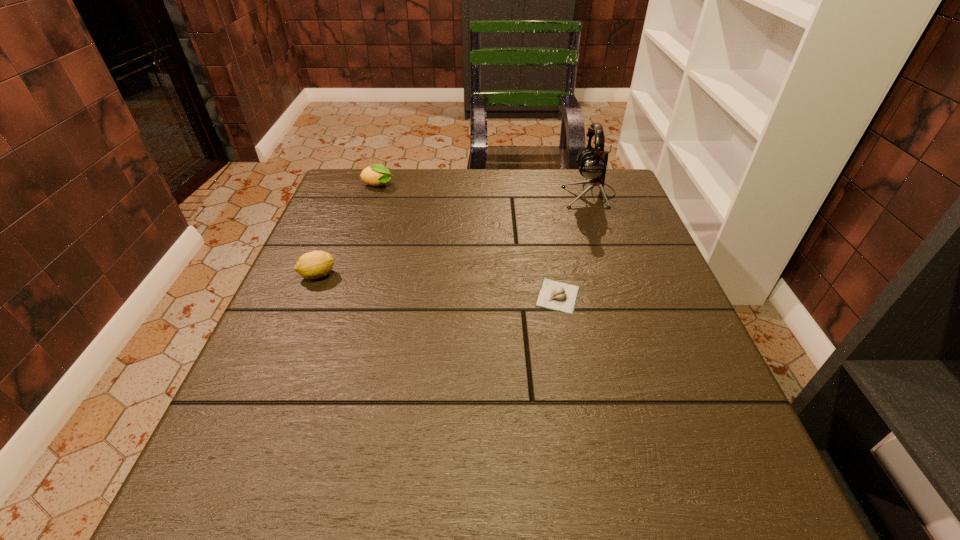
Locate an element on the screen. earphone situated at the far edge is located at coordinates (592, 163).

Find the location of a particular element. lemon situated at the far edge is located at coordinates (376, 175).

In order to click on object that is positioned at the right edge in this screenshot , I will do `click(592, 163)`.

Locate an element on the screen. The height and width of the screenshot is (540, 960). object located at the far left corner is located at coordinates (376, 175).

At what (x,y) coordinates should I click in order to perform the action: click on object situated at the far right corner. Please return your answer as a coordinate pair (x, y). Looking at the image, I should click on (592, 163).

Where is `vacant space at the far edge of the desktop`? vacant space at the far edge of the desktop is located at coordinates (474, 212).

The width and height of the screenshot is (960, 540). What are the coordinates of `free spot at the near edge of the desktop` in the screenshot? It's located at [312, 501].

This screenshot has width=960, height=540. In order to click on free region at the left edge in this screenshot , I will do coord(316,238).

Identify the location of free space at the right edge. The width and height of the screenshot is (960, 540). (636, 264).

In the image, there is a desktop. In order to click on free space at the far left corner in this screenshot , I will do `click(372, 187)`.